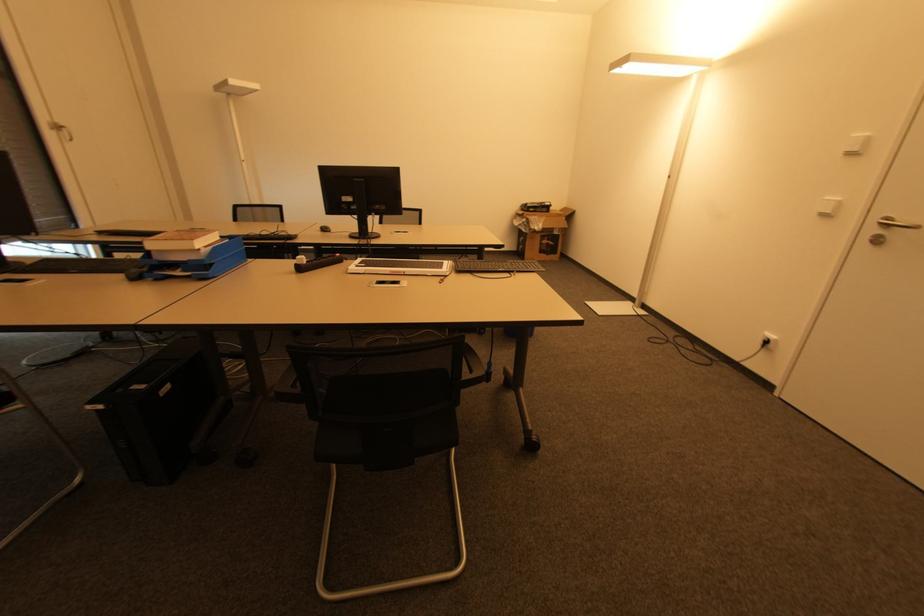
Where is `cardboard box`? cardboard box is located at coordinates (541, 233).